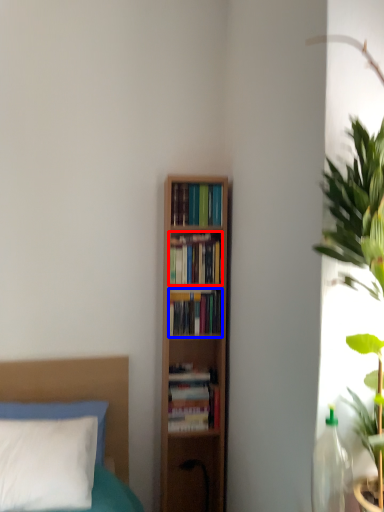
Question: Which object is further to the camera taking this photo, book (highlighted by a red box) or book (highlighted by a blue box)?

Choices:
 (A) book
 (B) book

Answer: (B)